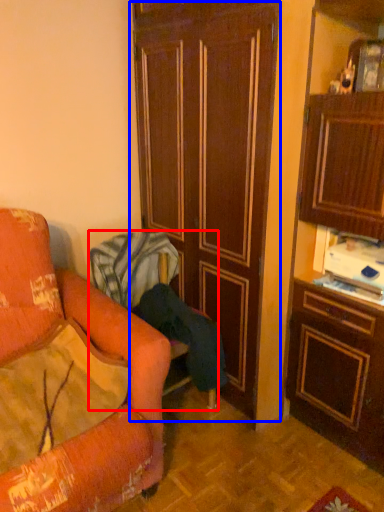
Question: Which of the following is the closest to the observer, chair (highlighted by a red box) or door (highlighted by a blue box)?

Choices:
 (A) chair
 (B) door

Answer: (B)